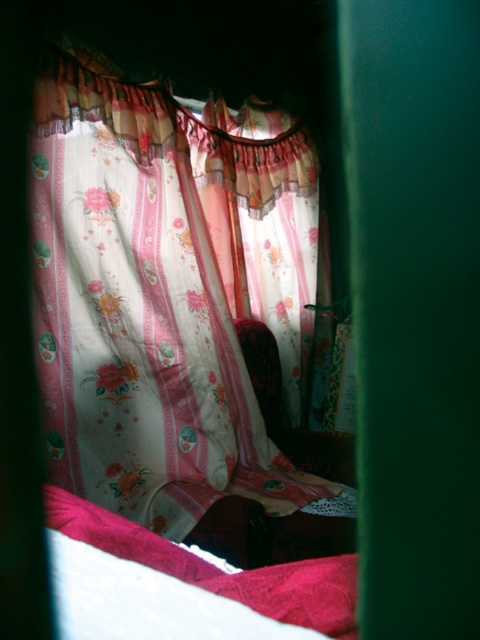
Is floral sheer curtain at upper center taller than velvet red blanket at lower left?

Yes.

Who is more distant from viewer, (x=223, y=497) or (x=216, y=573)?

The point (x=223, y=497) is behind.

Describe the element at coordinates (144, 305) in the screenshot. I see `floral sheer curtain at upper center` at that location.

Identify the location of floral sheer curtain at upper center. Image resolution: width=480 pixels, height=640 pixels. (144, 305).